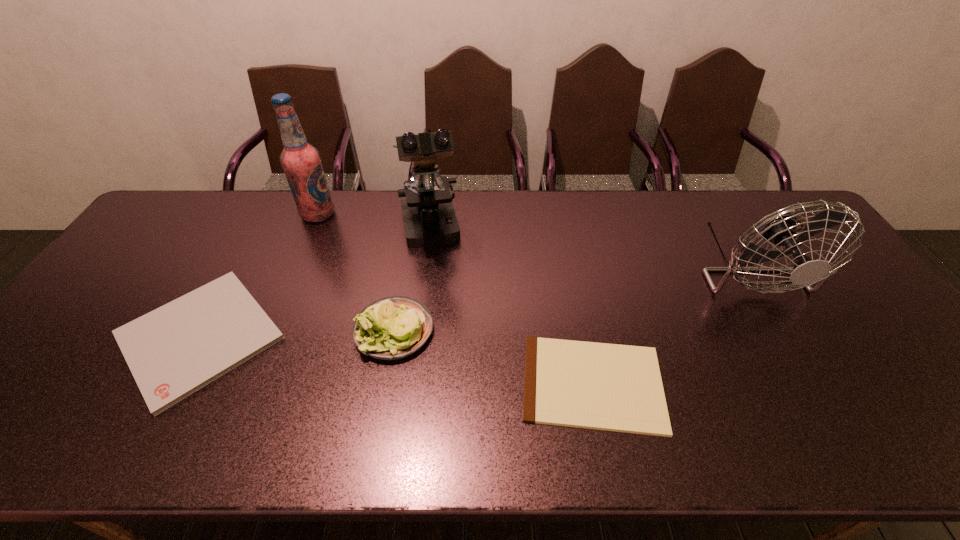
The height and width of the screenshot is (540, 960). I want to click on vacant space in between the second object from right to left and the microscope, so click(511, 307).

Identify the location of blank region between the rightmost object and the taller clipboard. (472, 301).

Where is `vacant space that is in between the fan and the third shortest object`? The width and height of the screenshot is (960, 540). vacant space that is in between the fan and the third shortest object is located at coordinates (569, 298).

Find the location of `vacant area between the fourth tallest object and the alcohol`. vacant area between the fourth tallest object and the alcohol is located at coordinates (356, 272).

Locate an element on the screen. free point between the lettuce and the second object from right to left is located at coordinates (493, 357).

This screenshot has height=540, width=960. Find the location of `vacant space in between the microscope and the rightmost object`. vacant space in between the microscope and the rightmost object is located at coordinates 588,248.

Image resolution: width=960 pixels, height=540 pixels. In order to click on object that ranks as the fourth closest to the fan in this screenshot , I will do `click(301, 162)`.

Locate which object is the fifth closest to the rightmost object. Please provide its 2D coordinates. Your answer should be formatted as a tuple, i.e. [(x, y)], where the tuple contains the x and y coordinates of a point satisfying the conditions above.

[(173, 351)]

Where is `free space in the image that satisfies the following two spatial constraints: 1. on the back side of the fourth tallest object; 2. on the left side of the taller clipboard`? Image resolution: width=960 pixels, height=540 pixels. free space in the image that satisfies the following two spatial constraints: 1. on the back side of the fourth tallest object; 2. on the left side of the taller clipboard is located at coordinates (203, 330).